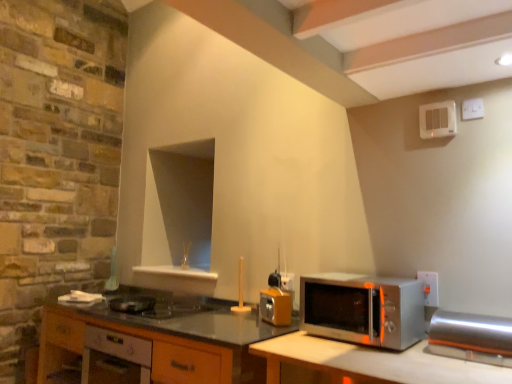
Identify the location of satin silver toaster oven at right, the 2th appliance positioned from the bottom. The width and height of the screenshot is (512, 384). (471, 337).

Describe the element at coordinates (287, 281) in the screenshot. The image size is (512, 384). I see `white plastic electric outlet at right, arranged as the second electric outlet when viewed from the right` at that location.

What is the approximate width of white plastic electric outlet at right, the first electric outlet positioned from the right?

white plastic electric outlet at right, the first electric outlet positioned from the right, is 0.65 inches in width.

Describe the element at coordinates (429, 287) in the screenshot. I see `white plastic electric outlet at right, the first electric outlet from the front` at that location.

The height and width of the screenshot is (384, 512). What do you see at coordinates (227, 349) in the screenshot?
I see `wooden cabinet at lower left, marked as the 2th cabinetry in a right-to-left arrangement` at bounding box center [227, 349].

What do you see at coordinates (362, 309) in the screenshot?
I see `satin silver microwave at right` at bounding box center [362, 309].

The height and width of the screenshot is (384, 512). Describe the element at coordinates (128, 351) in the screenshot. I see `wooden cabinet at lower left, placed as the second cabinetry when sorted from left to right` at that location.

Image resolution: width=512 pixels, height=384 pixels. What are the coordinates of `satin silver toaster oven at right, the second appliance viewed from the top` in the screenshot? It's located at (471, 337).

Considering the relative positions of white plastic electric outlet at right, which is the second electric outlet in back-to-front order, and white plastic exhaust fan at upper right, marked as the second appliance in a right-to-left arrangement, in the image provided, is white plastic electric outlet at right, which is the second electric outlet in back-to-front order, to the left of white plastic exhaust fan at upper right, marked as the second appliance in a right-to-left arrangement, from the viewer's perspective?

Yes.

Considering the relative sizes of white plastic electric outlet at right, which is the second electric outlet in back-to-front order, and white plastic exhaust fan at upper right, which ranks as the second appliance in front-to-back order, in the image provided, is white plastic electric outlet at right, which is the second electric outlet in back-to-front order, thinner than white plastic exhaust fan at upper right, which ranks as the second appliance in front-to-back order,?

Indeed, white plastic electric outlet at right, which is the second electric outlet in back-to-front order, has a lesser width compared to white plastic exhaust fan at upper right, which ranks as the second appliance in front-to-back order.

Is point (432, 301) positioned in front of point (429, 120)?

Yes, it is.

Is white plastic electric outlet at right, the first electric outlet from the front, positioned beyond the bounds of white plastic exhaust fan at upper right, which is counted as the 3th appliance, starting from the bottom?

Yes.

Could you tell me if white plastic electric outlet at right, which is the second electric outlet in back-to-front order, is turned towards satin silver toaster oven at right, the first appliance from the front?

No, white plastic electric outlet at right, which is the second electric outlet in back-to-front order, is not facing towards satin silver toaster oven at right, the first appliance from the front.

Is white plastic electric outlet at right, the first electric outlet from the front, positioned far away from satin silver toaster oven at right, which ranks as the third appliance in back-to-front order?

No, white plastic electric outlet at right, the first electric outlet from the front, is not far from satin silver toaster oven at right, which ranks as the third appliance in back-to-front order.

Is white plastic electric outlet at right, which is the second electric outlet in back-to-front order, to the left or to the right of satin silver toaster oven at right, which ranks as the third appliance in back-to-front order, in the image?

From the image, it's evident that white plastic electric outlet at right, which is the second electric outlet in back-to-front order, is to the left of satin silver toaster oven at right, which ranks as the third appliance in back-to-front order.

Relative to satin silver toaster oven at right, the first appliance in the right-to-left sequence, is white plastic electric outlet at right, which is counted as the second electric outlet, starting from the left, in front or behind?

Visually, white plastic electric outlet at right, which is counted as the second electric outlet, starting from the left, is located behind satin silver toaster oven at right, the first appliance in the right-to-left sequence.

Is point (129, 311) closer or farther from the camera than point (461, 347)?

Point (129, 311) is farther from the camera than point (461, 347).

Does shiny metallic pan at center, the first appliance in the bottom-to-top sequence, contain satin silver toaster oven at right, arranged as the third appliance when viewed from the left?

Actually, satin silver toaster oven at right, arranged as the third appliance when viewed from the left, is outside shiny metallic pan at center, the first appliance in the bottom-to-top sequence.

Between shiny metallic pan at center, the third appliance in the front-to-back sequence, and satin silver toaster oven at right, the first appliance in the right-to-left sequence, which one has smaller size?

shiny metallic pan at center, the third appliance in the front-to-back sequence, is smaller.

Is shiny metallic pan at center, the third appliance in the front-to-back sequence, closer to the viewer compared to satin silver toaster oven at right, arranged as the third appliance when viewed from the left?

No, it is not.

This screenshot has width=512, height=384. What are the coordinates of `the 2nd appliance positioned below the white plastic electric outlet at right, marked as the first electric outlet in a back-to-front arrangement (from a real-world perspective)` in the screenshot? It's located at (132, 304).

Which point is more forward, (283, 278) or (117, 308)?

The point (283, 278) is closer.

Could you tell me if white plastic electric outlet at right, marked as the first electric outlet in a back-to-front arrangement, is facing shiny metallic pan at center, which is the third appliance in right-to-left order?

No, white plastic electric outlet at right, marked as the first electric outlet in a back-to-front arrangement, is not facing towards shiny metallic pan at center, which is the third appliance in right-to-left order.

Considering the sizes of white plastic electric outlet at right, the first electric outlet from the left, and shiny metallic pan at center, the 1th appliance from the left, in the image, is white plastic electric outlet at right, the first electric outlet from the left, wider or thinner than shiny metallic pan at center, the 1th appliance from the left,?

Considering their sizes, white plastic electric outlet at right, the first electric outlet from the left, looks slimmer than shiny metallic pan at center, the 1th appliance from the left.

Between satin silver microwave at right and white plastic electric outlet at right, marked as the 2th electric outlet in a front-to-back arrangement, which one is positioned behind?

white plastic electric outlet at right, marked as the 2th electric outlet in a front-to-back arrangement, is further from the camera.

Between satin silver microwave at right and white plastic electric outlet at right, the first electric outlet from the left, which one has smaller size?

white plastic electric outlet at right, the first electric outlet from the left.

Considering the relative sizes of satin silver microwave at right and white plastic electric outlet at right, the first electric outlet from the left, in the image provided, is satin silver microwave at right wider than white plastic electric outlet at right, the first electric outlet from the left,?

Indeed, satin silver microwave at right has a greater width compared to white plastic electric outlet at right, the first electric outlet from the left.

How far apart are white plastic electric outlet at right, marked as the 2th electric outlet in a front-to-back arrangement, and satin silver microwave at right?

white plastic electric outlet at right, marked as the 2th electric outlet in a front-to-back arrangement, is 25.00 inches from satin silver microwave at right.

Are white plastic electric outlet at right, marked as the first electric outlet in a back-to-front arrangement, and satin silver microwave at right beside each other?

They are not placed beside each other.

From a real-world perspective, is white plastic electric outlet at right, the first electric outlet from the left, positioned over satin silver microwave at right based on gravity?

Correct, in the physical world, white plastic electric outlet at right, the first electric outlet from the left, is higher than satin silver microwave at right.

Considering the relative sizes of white plastic electric outlet at right, arranged as the second electric outlet when viewed from the right, and satin silver microwave at right in the image provided, is white plastic electric outlet at right, arranged as the second electric outlet when viewed from the right, thinner than satin silver microwave at right?

Yes.

Considering the relative sizes of white plastic exhaust fan at upper right, the 2th appliance viewed from the back, and shiny metallic pan at center, which is the third appliance in right-to-left order, in the image provided, is white plastic exhaust fan at upper right, the 2th appliance viewed from the back, bigger than shiny metallic pan at center, which is the third appliance in right-to-left order,?

No.

Is white plastic exhaust fan at upper right, which ranks as the second appliance in front-to-back order, looking in the opposite direction of shiny metallic pan at center, which is the third appliance in right-to-left order?

No, shiny metallic pan at center, which is the third appliance in right-to-left order, is not at the back of white plastic exhaust fan at upper right, which ranks as the second appliance in front-to-back order.

What's the angular difference between white plastic exhaust fan at upper right, marked as the second appliance in a right-to-left arrangement, and shiny metallic pan at center, the first appliance in the bottom-to-top sequence,'s facing directions?

white plastic exhaust fan at upper right, marked as the second appliance in a right-to-left arrangement, and shiny metallic pan at center, the first appliance in the bottom-to-top sequence, are facing 0.37 degrees away from each other.

Starting from the white plastic electric outlet at right, the first electric outlet from the front, which appliance is the 1st one to the right? Please provide its 2D coordinates.

[(438, 120)]

Find the location of `the 1st electric outlet to the left of the satin silver toaster oven at right, the 2th appliance positioned from the bottom, counting from the anchor's position`. the 1st electric outlet to the left of the satin silver toaster oven at right, the 2th appliance positioned from the bottom, counting from the anchor's position is located at coordinates (429, 287).

Looking at this image, when comparing their distances from white plastic electric outlet at right, arranged as the second electric outlet when viewed from the right, does wooden cabinet at lower left, marked as the 2th cabinetry in a right-to-left arrangement, or white plastic exhaust fan at upper right, the 2th appliance viewed from the back, seem closer?

Based on the image, wooden cabinet at lower left, marked as the 2th cabinetry in a right-to-left arrangement, appears to be nearer to white plastic electric outlet at right, arranged as the second electric outlet when viewed from the right.

From the image, which object appears to be nearer to white plastic electric outlet at right, the first electric outlet from the front, satin silver toaster oven at right, the 2th appliance positioned from the bottom, or shiny metallic pan at center, the first appliance in the bottom-to-top sequence?

satin silver toaster oven at right, the 2th appliance positioned from the bottom.

When comparing their distances from white plastic exhaust fan at upper right, marked as the second appliance in a right-to-left arrangement, does white plastic electric outlet at right, marked as the first electric outlet in a back-to-front arrangement, or satin silver toaster oven at right, the first appliance from the front, seem closer?

Among the two, satin silver toaster oven at right, the first appliance from the front, is located nearer to white plastic exhaust fan at upper right, marked as the second appliance in a right-to-left arrangement.

Estimate the real-world distances between objects in this image. Which object is closer to white plastic exhaust fan at upper right, marked as the second appliance in a right-to-left arrangement, shiny metallic pan at center, the third appliance in the front-to-back sequence, or satin silver microwave at right?

satin silver microwave at right is closer to white plastic exhaust fan at upper right, marked as the second appliance in a right-to-left arrangement.

Considering their positions, is wooden cabinet at lower left, positioned as the first cabinetry in right-to-left order, positioned closer to satin silver toaster oven at right, the 2th appliance positioned from the bottom, than wooden cabinet at lower left, marked as the 2th cabinetry in a right-to-left arrangement?

wooden cabinet at lower left, marked as the 2th cabinetry in a right-to-left arrangement.

Based on their spatial positions, is wooden cabinet at lower left, positioned as the first cabinetry in right-to-left order, or white plastic electric outlet at right, marked as the 2th electric outlet in a front-to-back arrangement, further from white plastic electric outlet at right, the first electric outlet from the front?

The object further to white plastic electric outlet at right, the first electric outlet from the front, is wooden cabinet at lower left, positioned as the first cabinetry in right-to-left order.

Based on their spatial positions, is white plastic electric outlet at right, arranged as the second electric outlet when viewed from the right, or satin silver microwave at right closer to wooden cabinet at lower left, the first cabinetry from the left?

satin silver microwave at right is positioned closer to the anchor wooden cabinet at lower left, the first cabinetry from the left.

Considering their positions, is shiny metallic pan at center, which is counted as the third appliance, starting from the top, positioned closer to white plastic electric outlet at right, which is counted as the second electric outlet, starting from the left, than white plastic electric outlet at right, arranged as the second electric outlet when viewed from the right?

Among the two, white plastic electric outlet at right, arranged as the second electric outlet when viewed from the right, is located nearer to white plastic electric outlet at right, which is counted as the second electric outlet, starting from the left.

Image resolution: width=512 pixels, height=384 pixels. Find the location of `microwave oven situated between wooden cabinet at lower left, positioned as the first cabinetry in right-to-left order, and white plastic electric outlet at right, the first electric outlet from the front, from left to right`. microwave oven situated between wooden cabinet at lower left, positioned as the first cabinetry in right-to-left order, and white plastic electric outlet at right, the first electric outlet from the front, from left to right is located at coordinates (362, 309).

Locate an element on the screen. The image size is (512, 384). microwave oven between white plastic exhaust fan at upper right, which is counted as the 3th appliance, starting from the bottom, and satin silver toaster oven at right, the second appliance viewed from the top, vertically is located at coordinates pos(362,309).

Locate an element on the screen. microwave oven between wooden cabinet at lower left, the first cabinetry from the left, and white plastic electric outlet at right, which is counted as the second electric outlet, starting from the left is located at coordinates (362, 309).

Locate an element on the screen. appliance between wooden cabinet at lower left, positioned as the first cabinetry in right-to-left order, and satin silver toaster oven at right, the first appliance from the front is located at coordinates (438, 120).